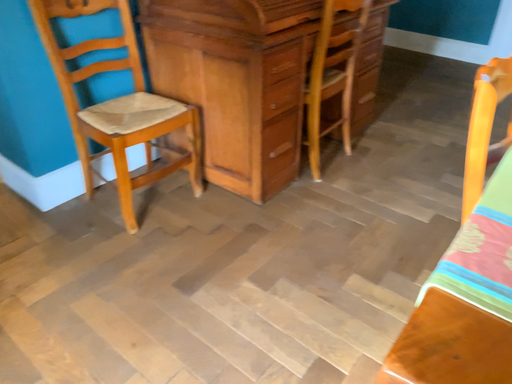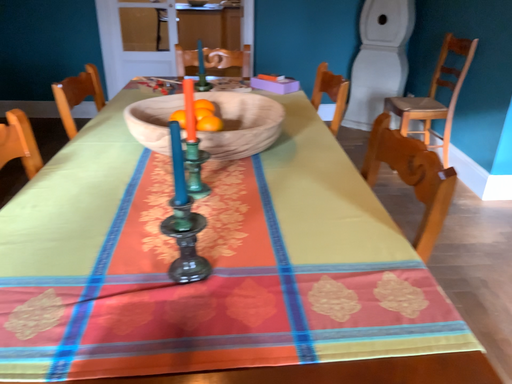
Question: How did the camera likely rotate when shooting the video?

Choices:
 (A) rotated left
 (B) rotated right

Answer: (B)